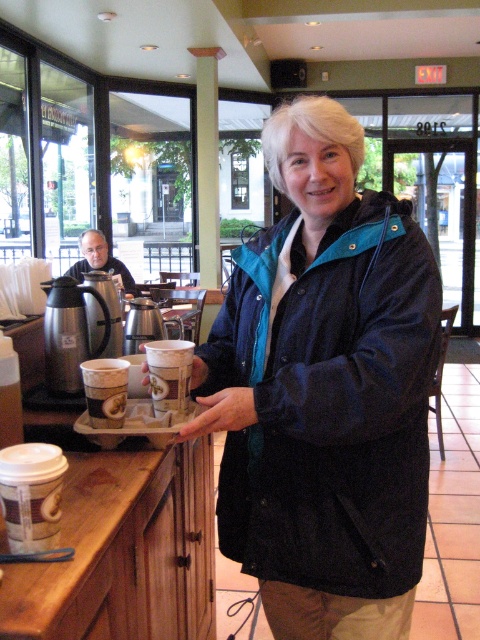
Question: Which is farther from the dark blue corduroy jacket at center?

Choices:
 (A) white paper cup at center
 (B) smooth skin hand at center

Answer: (A)

Question: Which point is closer to the camera?

Choices:
 (A) (240, 424)
 (B) (120, 365)
 (C) (379, 531)

Answer: (A)

Question: Is matte plastic cup at center above smooth skin hand at center?

Choices:
 (A) yes
 (B) no

Answer: (A)

Question: Is the position of dark blue corduroy jacket at center more distant than that of white paper cup at center?

Choices:
 (A) no
 (B) yes

Answer: (A)

Question: Which object appears closest to the camera in this image?

Choices:
 (A) white paper cup at center
 (B) smooth skin hand at center
 (C) dark blue corduroy jacket at center
 (D) matte plastic cup at center

Answer: (C)

Question: Where is dark blue corduroy jacket at center located in relation to matte plastic cup at center in the image?

Choices:
 (A) below
 (B) above

Answer: (B)